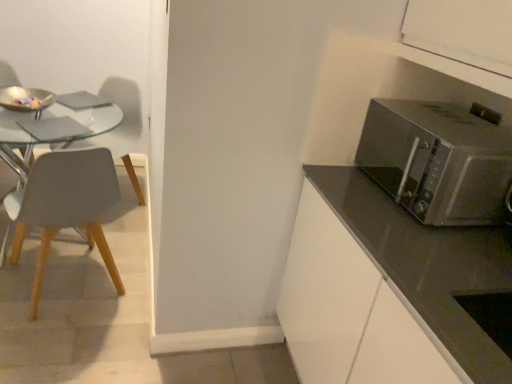
Question: In terms of height, does satin silver microwave at right look taller or shorter compared to matte gray chair at left, placed as the 1th chair when sorted from back to front?

Choices:
 (A) tall
 (B) short

Answer: (B)

Question: Is point (411, 173) closer or farther from the camera than point (130, 137)?

Choices:
 (A) farther
 (B) closer

Answer: (B)

Question: Considering the real-world distances, which object is closest to the matte gray chair at left, the 2th chair viewed from the back?

Choices:
 (A) satin silver microwave at right
 (B) matte gray chair at left, which is counted as the 2th chair, starting from the front

Answer: (B)

Question: Which of these objects is positioned closest to the matte gray chair at left, which appears as the 1th chair when viewed from the front?

Choices:
 (A) satin silver microwave at right
 (B) matte gray chair at left, placed as the 1th chair when sorted from back to front

Answer: (B)